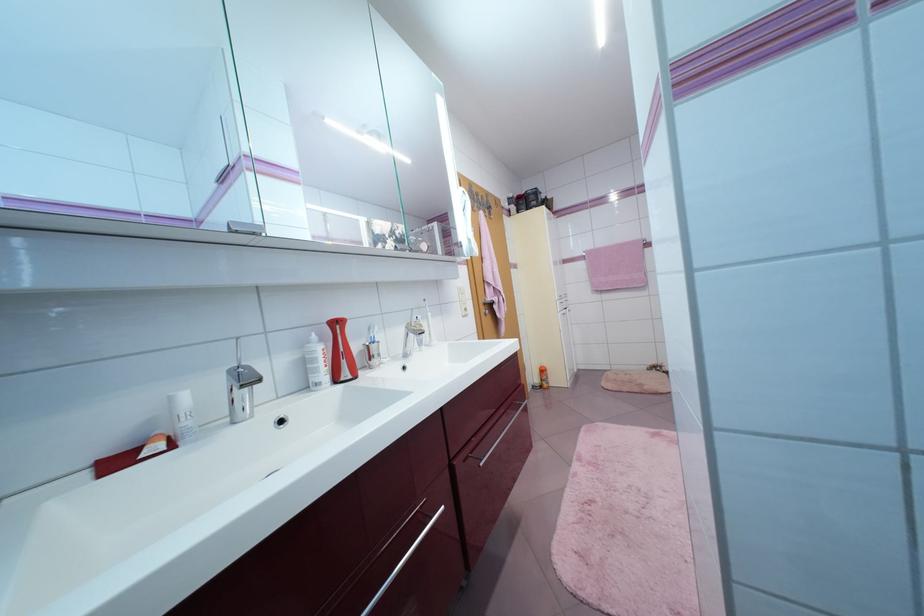
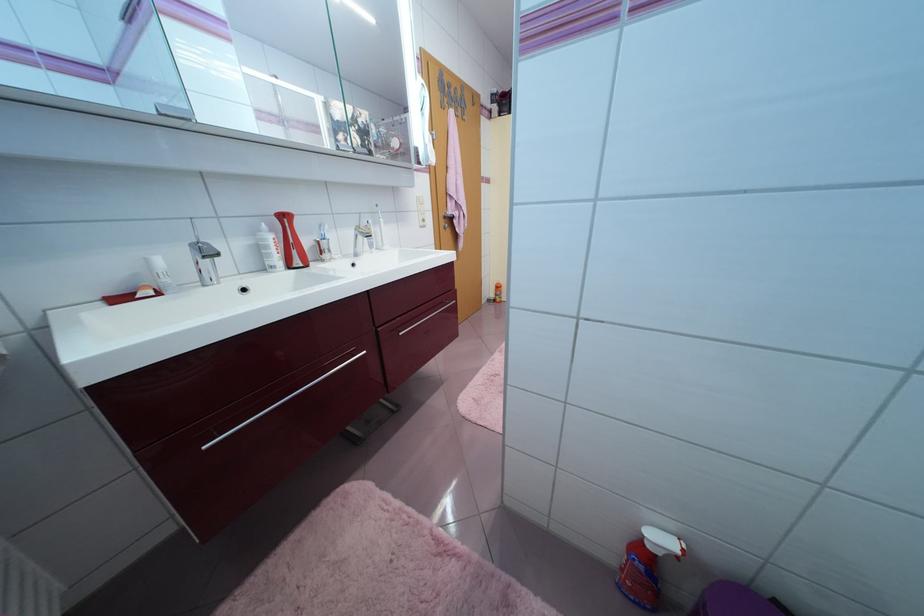
Locate, in the second image, the point that corresponds to the point at 475,241 in the first image.

(431, 147)